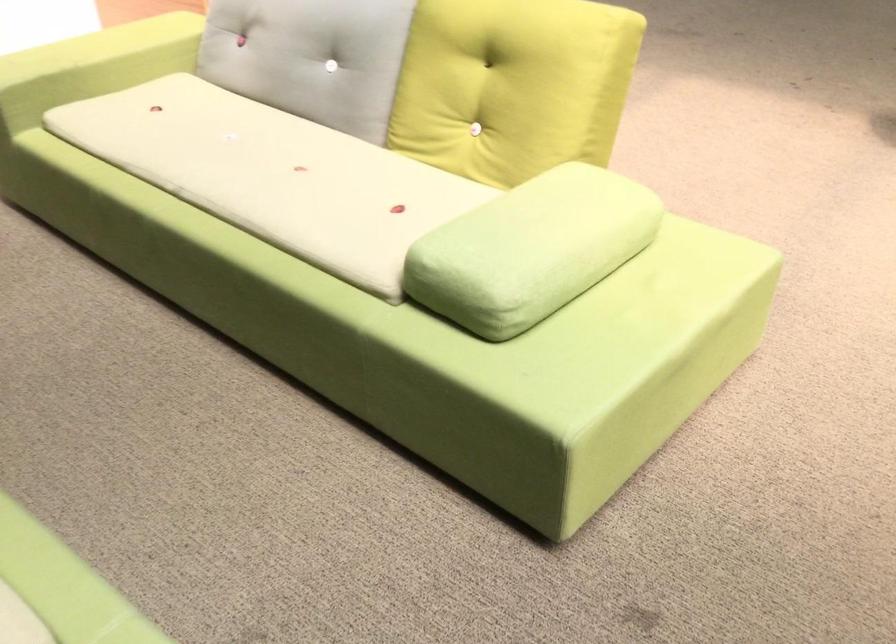
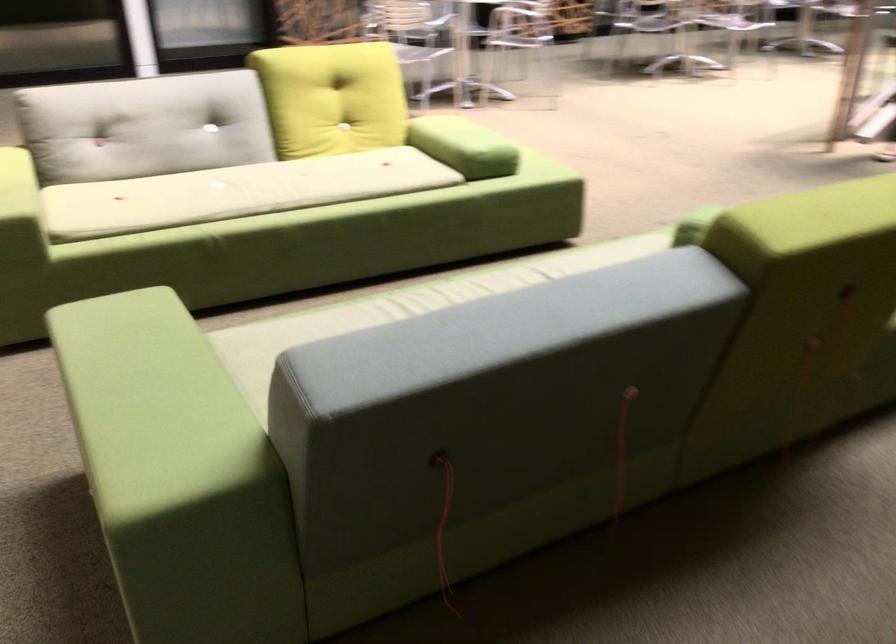
Locate, in the second image, the point that corresponds to pixel 421 243 in the first image.

(464, 146)